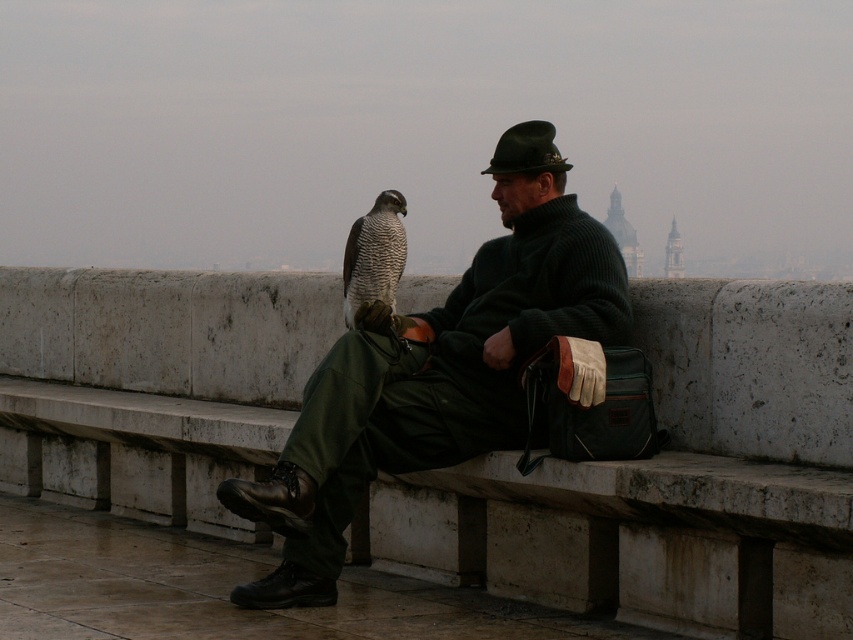
Does point (308, 595) come in front of point (387, 236)?

Yes, it is.

Locate an element on the screen. The height and width of the screenshot is (640, 853). matte green sweater at center is located at coordinates (431, 380).

Who is positioned more to the left, speckled feathers falcon at center or green felt hat at center?

From the viewer's perspective, speckled feathers falcon at center appears more on the left side.

Is point (375, 218) positioned in front of point (515, 147)?

No, (375, 218) is further to viewer.

Image resolution: width=853 pixels, height=640 pixels. Find the location of `speckled feathers falcon at center`. speckled feathers falcon at center is located at coordinates (374, 253).

Which of these two, matte green sweater at center or green felt hat at center, stands taller?

With more height is green felt hat at center.

Does matte green sweater at center have a smaller size compared to green felt hat at center?

Yes.

You are a GUI agent. You are given a task and a screenshot of the screen. Output one action in this format:
    pyautogui.click(x=<x>, y=<y>)
    Task: Click on the matte green sweater at center
    This screenshot has height=640, width=853.
    Given the screenshot: What is the action you would take?
    pyautogui.click(x=431, y=380)